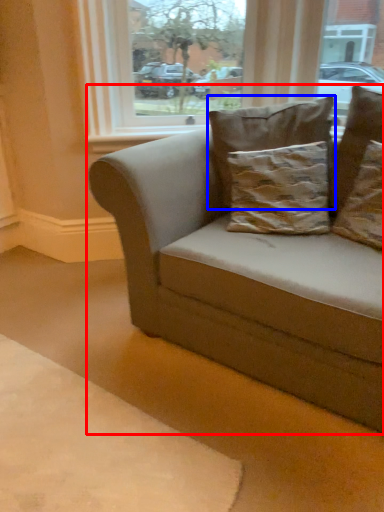
Question: Which object is further to the camera taking this photo, studio couch (highlighted by a red box) or pillow (highlighted by a blue box)?

Choices:
 (A) studio couch
 (B) pillow

Answer: (B)